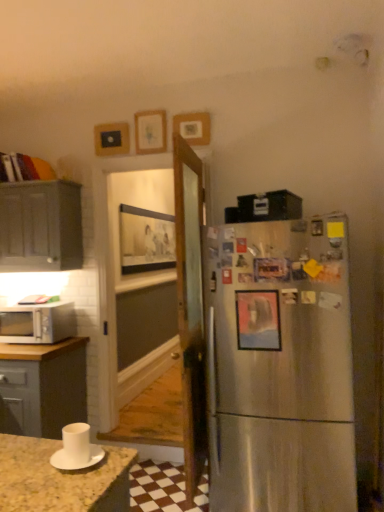
What do you see at coordinates (73, 462) in the screenshot?
I see `white matte saucer at lower left` at bounding box center [73, 462].

What is the approximate width of white glossy microwave at left?

The width of white glossy microwave at left is 15.45 inches.

The image size is (384, 512). I want to click on metallic silver picture frame at right, which ranks as the fifth picture frame in top-to-bottom order, so click(258, 320).

The width and height of the screenshot is (384, 512). What do you see at coordinates (77, 442) in the screenshot? I see `white matte cup at lower left` at bounding box center [77, 442].

Measure the distance between point (121,148) and camera.

Point (121,148) is 3.25 meters away from camera.

Locate an element on the screen. The height and width of the screenshot is (512, 384). white matte saucer at lower left is located at coordinates (73, 462).

Measure the distance from wooden picture frame at upper center, the fourth picture frame positioned from the bottom, to white matte cup at lower left.

wooden picture frame at upper center, the fourth picture frame positioned from the bottom, is 7.36 feet from white matte cup at lower left.

Which of these two, wooden picture frame at upper center, the fourth picture frame positioned from the bottom, or white matte cup at lower left, stands taller?

wooden picture frame at upper center, the fourth picture frame positioned from the bottom, is taller.

Is there a large distance between wooden picture frame at upper center, the second picture frame positioned from the top, and white matte cup at lower left?

Yes, wooden picture frame at upper center, the second picture frame positioned from the top, is far from white matte cup at lower left.

Does point (191, 113) lie in front of point (74, 440)?

No, (191, 113) is behind (74, 440).

Is wooden picture frame at upper center, marked as the 3th picture frame in a front-to-back arrangement, positioned beyond the bounds of white glossy microwave at left?

Yes, wooden picture frame at upper center, marked as the 3th picture frame in a front-to-back arrangement, is located beyond the bounds of white glossy microwave at left.

Is wooden picture frame at upper center, arranged as the third picture frame when viewed from the back, taller or shorter than white glossy microwave at left?

Considering their sizes, wooden picture frame at upper center, arranged as the third picture frame when viewed from the back, has more height than white glossy microwave at left.

From a real-world perspective, is wooden picture frame at upper center, the fifth picture frame from the bottom, positioned over white glossy microwave at left based on gravity?

Indeed, from a real-world perspective, wooden picture frame at upper center, the fifth picture frame from the bottom, stands above white glossy microwave at left.

Which is behind, point (137, 125) or point (43, 315)?

The point (137, 125) is behind.

Considering the positions of point (163, 122) and point (101, 455), is point (163, 122) closer or farther from the camera than point (101, 455)?

Point (163, 122).

Is wooden picture frame at upper center, the fifth picture frame from the bottom, turned away from white matte saucer at lower left?

No.

Is there a large distance between wooden picture frame at upper center, the first picture frame when ordered from top to bottom, and white matte saucer at lower left?

That's right, there is a large distance between wooden picture frame at upper center, the first picture frame when ordered from top to bottom, and white matte saucer at lower left.

Considering the positions of objects wooden picture frame at upper center, marked as the 3th picture frame in a front-to-back arrangement, and white matte saucer at lower left in the image provided, who is more to the left, wooden picture frame at upper center, marked as the 3th picture frame in a front-to-back arrangement, or white matte saucer at lower left?

white matte saucer at lower left is more to the left.

How many degrees apart are the facing directions of metallic silver picture frame at right, positioned as the first picture frame in bottom-to-top order, and white matte saucer at lower left?

87.3 degrees separate the facing orientations of metallic silver picture frame at right, positioned as the first picture frame in bottom-to-top order, and white matte saucer at lower left.

Looking at the image, does metallic silver picture frame at right, positioned as the first picture frame in bottom-to-top order, seem bigger or smaller compared to white matte saucer at lower left?

In the image, metallic silver picture frame at right, positioned as the first picture frame in bottom-to-top order, appears to be larger than white matte saucer at lower left.

Considering their positions, is metallic silver picture frame at right, positioned as the first picture frame in bottom-to-top order, located in front of or behind white matte saucer at lower left?

metallic silver picture frame at right, positioned as the first picture frame in bottom-to-top order, is positioned farther from the viewer than white matte saucer at lower left.

Who is taller, metallic silver picture frame at right, which is the first picture frame in front-to-back order, or white matte saucer at lower left?

metallic silver picture frame at right, which is the first picture frame in front-to-back order, is taller.

Who is shorter, matte gray cabinet at left or wooden picture frame at center, acting as the 1th picture frame starting from the back?

matte gray cabinet at left.

Measure the distance between matte gray cabinet at left and wooden picture frame at center, the second picture frame positioned from the bottom.

matte gray cabinet at left is 1.13 meters from wooden picture frame at center, the second picture frame positioned from the bottom.

Does point (31, 197) come behind point (160, 256)?

No, it is not.

Is matte gray cabinet at left positioned behind wooden picture frame at center, the second picture frame positioned from the bottom?

No, the depth of matte gray cabinet at left is less than that of wooden picture frame at center, the second picture frame positioned from the bottom.

Looking at their sizes, would you say wooden picture frame at center, the 4th picture frame in the top-to-bottom sequence, is wider or thinner than white matte cup at lower left?

Considering their sizes, wooden picture frame at center, the 4th picture frame in the top-to-bottom sequence, looks slimmer than white matte cup at lower left.

How different are the orientations of wooden picture frame at center, acting as the 1th picture frame starting from the back, and white matte cup at lower left in degrees?

wooden picture frame at center, acting as the 1th picture frame starting from the back, and white matte cup at lower left are facing 179 degrees away from each other.

Which object is more forward, wooden picture frame at center, arranged as the fifth picture frame when viewed from the front, or white matte cup at lower left?

white matte cup at lower left is closer to the camera.

Is wooden picture frame at upper center, the 2th picture frame in the front-to-back sequence, smaller than wooden picture frame at upper center, marked as the 3th picture frame in a front-to-back arrangement?

Yes.

Is wooden picture frame at upper center, the 2th picture frame in the front-to-back sequence, at the right side of wooden picture frame at upper center, arranged as the third picture frame when viewed from the back?

Yes, wooden picture frame at upper center, the 2th picture frame in the front-to-back sequence, is to the right of wooden picture frame at upper center, arranged as the third picture frame when viewed from the back.

Which object is further away from the camera, wooden picture frame at upper center, the 2th picture frame in the front-to-back sequence, or wooden picture frame at upper center, the fifth picture frame from the bottom?

wooden picture frame at upper center, the fifth picture frame from the bottom, is further from the camera.

Is wooden picture frame at upper center, the second picture frame positioned from the top, placed right next to wooden picture frame at upper center, the fifth picture frame from the bottom?

No, wooden picture frame at upper center, the second picture frame positioned from the top, is not making contact with wooden picture frame at upper center, the fifth picture frame from the bottom.

This screenshot has height=512, width=384. I want to click on appliance in front of the wooden picture frame at upper center, the fourth picture frame in the back-to-front sequence, so click(x=77, y=442).

The width and height of the screenshot is (384, 512). I want to click on picture frame that is the 5th one when counting upward from the white glossy microwave at left (from the image's perspective), so click(150, 132).

Looking at the image, which one is located closer to white glossy microwave at left, white matte cup at lower left or wooden picture frame at center, acting as the 1th picture frame starting from the back?

Among the two, wooden picture frame at center, acting as the 1th picture frame starting from the back, is located nearer to white glossy microwave at left.

Which object lies nearer to the anchor point metallic rectangular frame at upper center, the third picture frame when ordered from bottom to top, white matte cup at lower left or white glossy microwave at left?

white glossy microwave at left is positioned closer to the anchor metallic rectangular frame at upper center, the third picture frame when ordered from bottom to top.

When comparing their distances from wooden picture frame at center, the 4th picture frame in the top-to-bottom sequence, does wooden picture frame at upper center, the fifth picture frame from the bottom, or wooden picture frame at upper center, the 2th picture frame in the front-to-back sequence, seem closer?

Based on the image, wooden picture frame at upper center, the fifth picture frame from the bottom, appears to be nearer to wooden picture frame at center, the 4th picture frame in the top-to-bottom sequence.

Based on their spatial positions, is wooden picture frame at center, arranged as the fifth picture frame when viewed from the front, or white matte cup at lower left closer to matte gray cabinet at left?

Among the two, wooden picture frame at center, arranged as the fifth picture frame when viewed from the front, is located nearer to matte gray cabinet at left.

Based on the photo, considering their positions, is metallic silver picture frame at right, positioned as the first picture frame in bottom-to-top order, positioned further to wooden picture frame at upper center, the first picture frame when ordered from top to bottom, than metallic rectangular frame at upper center, positioned as the 2th picture frame in back-to-front order?

The object further to wooden picture frame at upper center, the first picture frame when ordered from top to bottom, is metallic silver picture frame at right, positioned as the first picture frame in bottom-to-top order.

Which object lies further to the anchor point wooden picture frame at center, the 4th picture frame in the top-to-bottom sequence, white matte saucer at lower left or white glossy microwave at left?

white matte saucer at lower left is positioned further to the anchor wooden picture frame at center, the 4th picture frame in the top-to-bottom sequence.

Which object lies further to the anchor point metallic rectangular frame at upper center, positioned as the 2th picture frame in back-to-front order, wooden picture frame at upper center, arranged as the third picture frame when viewed from the back, or white matte cup at lower left?

Among the two, white matte cup at lower left is located further to metallic rectangular frame at upper center, positioned as the 2th picture frame in back-to-front order.

Looking at the image, which one is located closer to wooden picture frame at center, the second picture frame positioned from the bottom, wooden picture frame at upper center, the fourth picture frame in the back-to-front sequence, or wooden picture frame at upper center, marked as the 3th picture frame in a front-to-back arrangement?

Based on the image, wooden picture frame at upper center, marked as the 3th picture frame in a front-to-back arrangement, appears to be nearer to wooden picture frame at center, the second picture frame positioned from the bottom.

The image size is (384, 512). Identify the location of microwave oven between white matte cup at lower left and metallic rectangular frame at upper center, the third picture frame when ordered from bottom to top, from front to back. (38, 323).

The image size is (384, 512). Find the location of `microwave oven between white matte saucer at lower left and wooden picture frame at upper center, the fifth picture frame from the bottom, from front to back`. microwave oven between white matte saucer at lower left and wooden picture frame at upper center, the fifth picture frame from the bottom, from front to back is located at coordinates 38,323.

Find the location of a particular element. cabinetry between white matte cup at lower left and wooden picture frame at upper center, the second picture frame positioned from the top, along the z-axis is located at coordinates (40, 226).

Where is `appliance between white matte saucer at lower left and white glossy microwave at left along the z-axis`? appliance between white matte saucer at lower left and white glossy microwave at left along the z-axis is located at coordinates (77, 442).